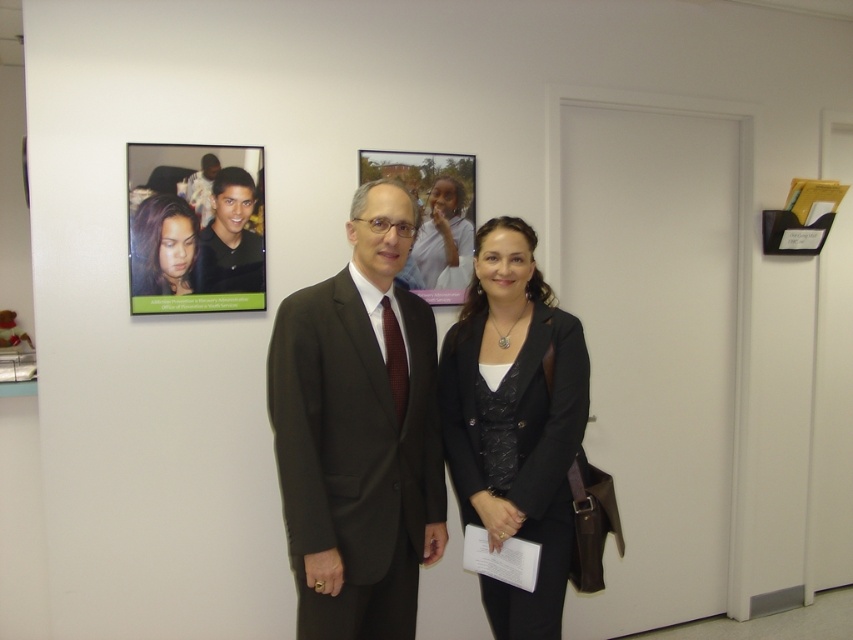
Question: Can you confirm if matte black photo at upper left is thinner than matte black hair at upper left?

Choices:
 (A) yes
 (B) no

Answer: (B)

Question: Which point appears closest to the camera in this image?

Choices:
 (A) (352, 369)
 (B) (447, 278)
 (C) (221, 284)
 (D) (521, 442)

Answer: (A)

Question: Based on their relative distances, which object is farther from the matte black hair at upper left?

Choices:
 (A) black leather jacket at center
 (B) matte black suit at center

Answer: (A)

Question: Among these points, which one is nearest to the camera?

Choices:
 (A) (223, 252)
 (B) (370, 396)
 (C) (154, 276)
 (D) (216, 195)

Answer: (B)

Question: Is matte black suit at upper left wider than matte black suit at center?

Choices:
 (A) yes
 (B) no

Answer: (B)

Question: Does black leather jacket at center appear on the left side of matte black suit at upper left?

Choices:
 (A) no
 (B) yes

Answer: (A)